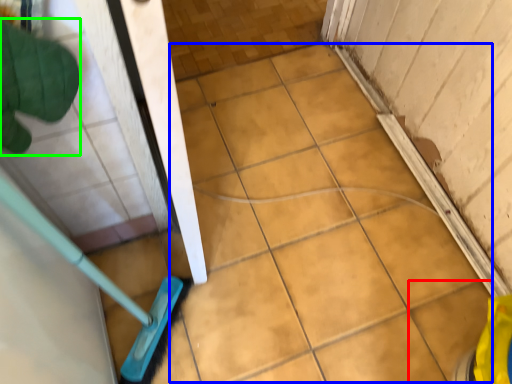
Question: Estimate the real-world distances between objects in this image. Which object is closer to ceramic tile (highlighted by a red box), ceramic tile (highlighted by a blue box) or hand (highlighted by a green box)?

Choices:
 (A) ceramic tile
 (B) hand

Answer: (A)